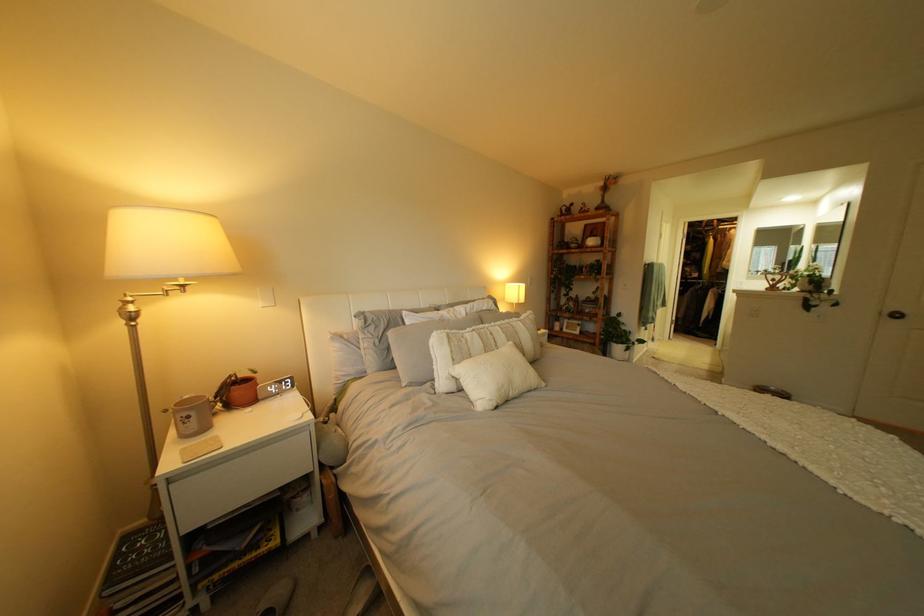
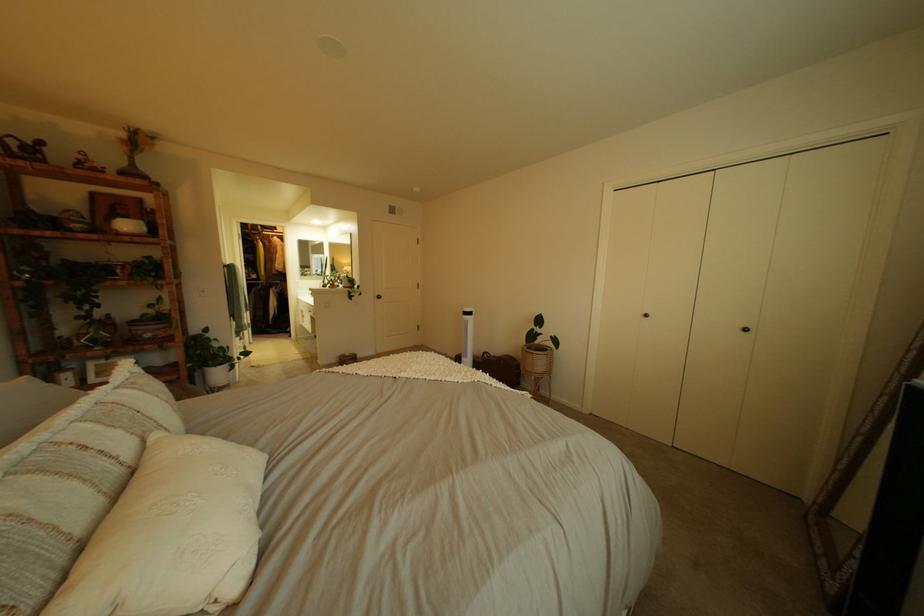
Question: The first image is from the beginning of the video and the second image is from the end. How did the camera likely rotate when shooting the video?

Choices:
 (A) Left
 (B) Right
 (C) Up
 (D) Down

Answer: (B)